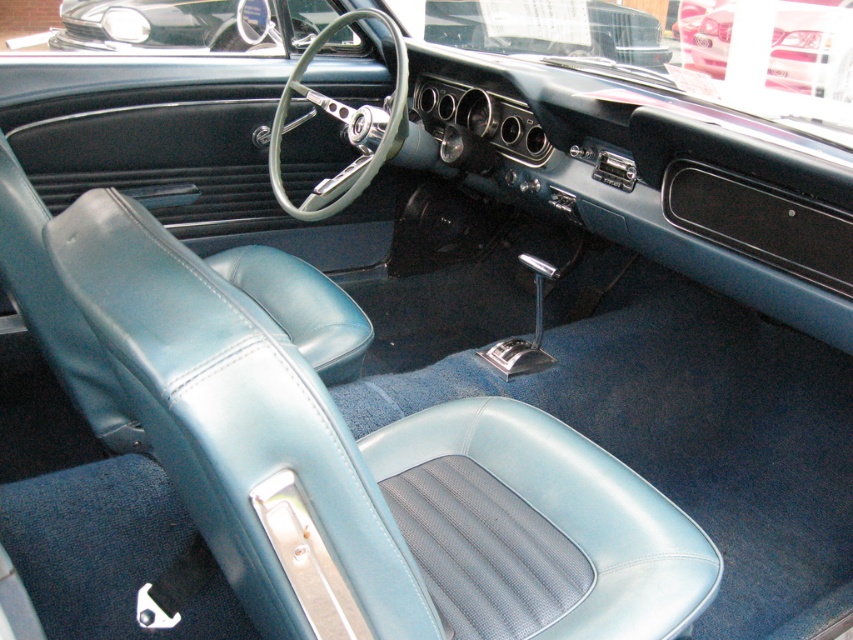
Is shiny chrome steering wheel at upper center above metallic silver car at upper center?

No.

Locate an element on the screen. The height and width of the screenshot is (640, 853). shiny chrome steering wheel at upper center is located at coordinates (548, 28).

From the picture: Who is more distant from viewer, (x=254, y=17) or (x=717, y=76)?

The point (x=717, y=76) is behind.

The width and height of the screenshot is (853, 640). What are the coordinates of `shiny chrome steering wheel at upper center` in the screenshot? It's located at (548, 28).